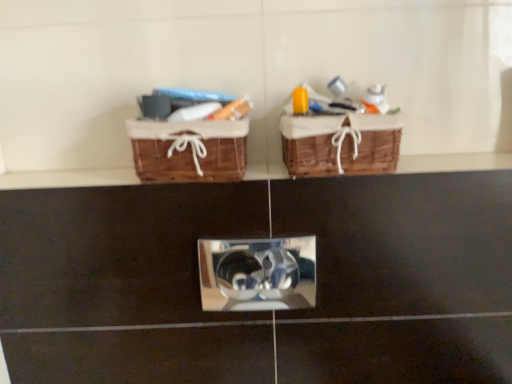
Find the location of a particular element. The width and height of the screenshot is (512, 384). woven brown picnic basket at upper center, which appears as the 2th picnic basket when viewed from the right is located at coordinates (189, 150).

Measure the distance between point (140,161) and camera.

Point (140,161) and camera are 33.43 inches apart.

Describe the element at coordinates (189, 150) in the screenshot. I see `woven brown picnic basket at upper center, which is counted as the first picnic basket, starting from the left` at that location.

This screenshot has height=384, width=512. What do you see at coordinates (341, 144) in the screenshot?
I see `woven brown picnic basket at upper center, which is counted as the 1th picnic basket, starting from the right` at bounding box center [341, 144].

This screenshot has width=512, height=384. I want to click on woven brown picnic basket at upper center, the second picnic basket when ordered from left to right, so click(x=341, y=144).

Locate an element on the screen. The height and width of the screenshot is (384, 512). woven brown picnic basket at upper center, which is counted as the first picnic basket, starting from the left is located at coordinates (189, 150).

Visually, is woven brown picnic basket at upper center, which is counted as the 1th picnic basket, starting from the right, positioned to the left or to the right of woven brown picnic basket at upper center, which appears as the 2th picnic basket when viewed from the right?

woven brown picnic basket at upper center, which is counted as the 1th picnic basket, starting from the right, is positioned on woven brown picnic basket at upper center, which appears as the 2th picnic basket when viewed from the right,'s right side.

In the scene shown: Which object is further away from the camera, woven brown picnic basket at upper center, which is counted as the 1th picnic basket, starting from the right, or woven brown picnic basket at upper center, which appears as the 2th picnic basket when viewed from the right?

woven brown picnic basket at upper center, which appears as the 2th picnic basket when viewed from the right, is behind.

Considering the points (348, 134) and (178, 142), which point is behind, point (348, 134) or point (178, 142)?

Positioned behind is point (348, 134).

From the image's perspective, is woven brown picnic basket at upper center, which is counted as the 1th picnic basket, starting from the right, above or below woven brown picnic basket at upper center, which is counted as the first picnic basket, starting from the left?

woven brown picnic basket at upper center, which is counted as the 1th picnic basket, starting from the right, is above woven brown picnic basket at upper center, which is counted as the first picnic basket, starting from the left.

From a real-world perspective, is woven brown picnic basket at upper center, the second picnic basket when ordered from left to right, positioned under woven brown picnic basket at upper center, which is counted as the first picnic basket, starting from the left, based on gravity?

Incorrect, from a real-world perspective, woven brown picnic basket at upper center, the second picnic basket when ordered from left to right, is higher than woven brown picnic basket at upper center, which is counted as the first picnic basket, starting from the left.

Can you confirm if woven brown picnic basket at upper center, the second picnic basket when ordered from left to right, is wider than woven brown picnic basket at upper center, which appears as the 2th picnic basket when viewed from the right?

Yes.

Considering the sizes of objects woven brown picnic basket at upper center, which is counted as the 1th picnic basket, starting from the right, and woven brown picnic basket at upper center, which is counted as the first picnic basket, starting from the left, in the image provided, who is taller, woven brown picnic basket at upper center, which is counted as the 1th picnic basket, starting from the right, or woven brown picnic basket at upper center, which is counted as the first picnic basket, starting from the left,?

With more height is woven brown picnic basket at upper center, which is counted as the 1th picnic basket, starting from the right.

In the scene shown: Considering the sizes of objects woven brown picnic basket at upper center, the second picnic basket when ordered from left to right, and woven brown picnic basket at upper center, which is counted as the first picnic basket, starting from the left, in the image provided, who is smaller, woven brown picnic basket at upper center, the second picnic basket when ordered from left to right, or woven brown picnic basket at upper center, which is counted as the first picnic basket, starting from the left,?

With smaller size is woven brown picnic basket at upper center, which is counted as the first picnic basket, starting from the left.

Could woven brown picnic basket at upper center, which is counted as the first picnic basket, starting from the left, be considered to be inside woven brown picnic basket at upper center, the second picnic basket when ordered from left to right?

No, woven brown picnic basket at upper center, the second picnic basket when ordered from left to right, does not contain woven brown picnic basket at upper center, which is counted as the first picnic basket, starting from the left.

Are woven brown picnic basket at upper center, the second picnic basket when ordered from left to right, and woven brown picnic basket at upper center, which appears as the 2th picnic basket when viewed from the right, far apart?

No, woven brown picnic basket at upper center, the second picnic basket when ordered from left to right, is in close proximity to woven brown picnic basket at upper center, which appears as the 2th picnic basket when viewed from the right.

Is woven brown picnic basket at upper center, the second picnic basket when ordered from left to right, aimed at woven brown picnic basket at upper center, which is counted as the first picnic basket, starting from the left?

No, woven brown picnic basket at upper center, the second picnic basket when ordered from left to right, is not facing towards woven brown picnic basket at upper center, which is counted as the first picnic basket, starting from the left.

Where is `picnic basket behind the woven brown picnic basket at upper center, which is counted as the 1th picnic basket, starting from the right`? picnic basket behind the woven brown picnic basket at upper center, which is counted as the 1th picnic basket, starting from the right is located at coordinates (189, 150).

Which is more to the right, woven brown picnic basket at upper center, which is counted as the first picnic basket, starting from the left, or woven brown picnic basket at upper center, the second picnic basket when ordered from left to right?

woven brown picnic basket at upper center, the second picnic basket when ordered from left to right.

Considering the positions of objects woven brown picnic basket at upper center, which appears as the 2th picnic basket when viewed from the right, and woven brown picnic basket at upper center, which is counted as the 1th picnic basket, starting from the right, in the image provided, who is behind, woven brown picnic basket at upper center, which appears as the 2th picnic basket when viewed from the right, or woven brown picnic basket at upper center, which is counted as the 1th picnic basket, starting from the right,?

woven brown picnic basket at upper center, which appears as the 2th picnic basket when viewed from the right, is further away from the camera.

Does point (233, 135) appear closer or farther from the camera than point (386, 143)?

Clearly, point (233, 135) is closer to the camera than point (386, 143).

From the image's perspective, which one is positioned higher, woven brown picnic basket at upper center, which appears as the 2th picnic basket when viewed from the right, or woven brown picnic basket at upper center, the second picnic basket when ordered from left to right?

woven brown picnic basket at upper center, the second picnic basket when ordered from left to right, appears higher in the image.

From a real-world perspective, is woven brown picnic basket at upper center, which is counted as the first picnic basket, starting from the left, on top of woven brown picnic basket at upper center, which is counted as the 1th picnic basket, starting from the right?

No, from a real-world perspective, woven brown picnic basket at upper center, which is counted as the first picnic basket, starting from the left, is not over woven brown picnic basket at upper center, which is counted as the 1th picnic basket, starting from the right

Which of these two, woven brown picnic basket at upper center, which appears as the 2th picnic basket when viewed from the right, or woven brown picnic basket at upper center, which is counted as the 1th picnic basket, starting from the right, is thinner?

Thinner between the two is woven brown picnic basket at upper center, which appears as the 2th picnic basket when viewed from the right.

In terms of height, does woven brown picnic basket at upper center, which is counted as the first picnic basket, starting from the left, look taller or shorter compared to woven brown picnic basket at upper center, the second picnic basket when ordered from left to right?

In the image, woven brown picnic basket at upper center, which is counted as the first picnic basket, starting from the left, appears to be shorter than woven brown picnic basket at upper center, the second picnic basket when ordered from left to right.

Considering the relative sizes of woven brown picnic basket at upper center, which appears as the 2th picnic basket when viewed from the right, and woven brown picnic basket at upper center, which is counted as the 1th picnic basket, starting from the right, in the image provided, is woven brown picnic basket at upper center, which appears as the 2th picnic basket when viewed from the right, smaller than woven brown picnic basket at upper center, which is counted as the 1th picnic basket, starting from the right,?

Yes, woven brown picnic basket at upper center, which appears as the 2th picnic basket when viewed from the right, is smaller than woven brown picnic basket at upper center, which is counted as the 1th picnic basket, starting from the right.

Would you say woven brown picnic basket at upper center, the second picnic basket when ordered from left to right, is part of woven brown picnic basket at upper center, which is counted as the first picnic basket, starting from the left,'s contents?

No, woven brown picnic basket at upper center, which is counted as the first picnic basket, starting from the left, does not contain woven brown picnic basket at upper center, the second picnic basket when ordered from left to right.

Based on the photo, is woven brown picnic basket at upper center, which is counted as the first picnic basket, starting from the left, far away from woven brown picnic basket at upper center, which is counted as the 1th picnic basket, starting from the right?

No, woven brown picnic basket at upper center, which is counted as the first picnic basket, starting from the left, is not far away from woven brown picnic basket at upper center, which is counted as the 1th picnic basket, starting from the right.

Does woven brown picnic basket at upper center, which appears as the 2th picnic basket when viewed from the right, turn towards woven brown picnic basket at upper center, which is counted as the 1th picnic basket, starting from the right?

No, woven brown picnic basket at upper center, which appears as the 2th picnic basket when viewed from the right, does not turn towards woven brown picnic basket at upper center, which is counted as the 1th picnic basket, starting from the right.

This screenshot has width=512, height=384. I want to click on picnic basket above the woven brown picnic basket at upper center, which appears as the 2th picnic basket when viewed from the right (from a real-world perspective), so click(x=341, y=144).

At what (x,y) coordinates should I click in order to perform the action: click on picnic basket in front of the woven brown picnic basket at upper center, which is counted as the first picnic basket, starting from the left. Please return your answer as a coordinate pair (x, y). Looking at the image, I should click on (341, 144).

Where is `picnic basket below the woven brown picnic basket at upper center, the second picnic basket when ordered from left to right (from a real-world perspective)`? picnic basket below the woven brown picnic basket at upper center, the second picnic basket when ordered from left to right (from a real-world perspective) is located at coordinates (189, 150).